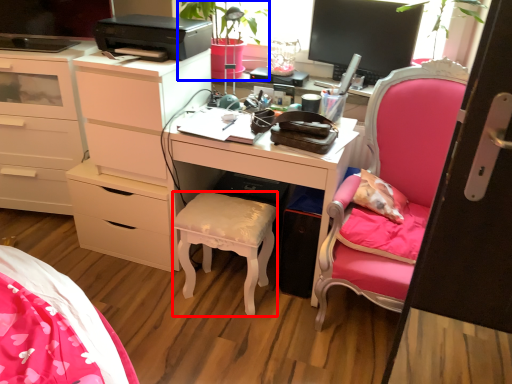
Question: Which of the following is the farthest to the observer, stool (highlighted by a red box) or houseplant (highlighted by a blue box)?

Choices:
 (A) stool
 (B) houseplant

Answer: (B)